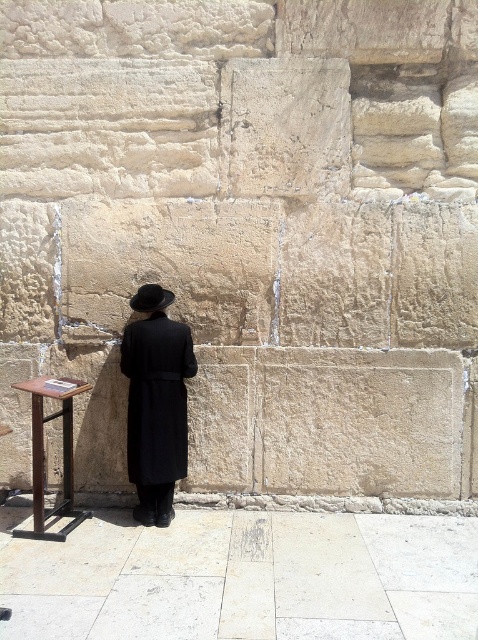
Can you confirm if brown wooden stool at lower left is positioned to the right of black felt fedora at center?

In fact, brown wooden stool at lower left is to the left of black felt fedora at center.

Image resolution: width=478 pixels, height=640 pixels. Identify the location of brown wooden stool at lower left. (43, 454).

You are a GUI agent. You are given a task and a screenshot of the screen. Output one action in this format:
    pyautogui.click(x=<x>, y=<y>)
    Task: Click on the brown wooden stool at lower left
    Image resolution: width=478 pixels, height=640 pixels.
    Given the screenshot: What is the action you would take?
    pyautogui.click(x=43, y=454)

Can you confirm if black matte coat at center is smaller than brown wooden stool at lower left?

Indeed, black matte coat at center has a smaller size compared to brown wooden stool at lower left.

Between point (173, 484) and point (35, 474), which one is positioned in front?

Point (35, 474)

Between point (186, 324) and point (80, 513), which one is positioned behind?

The point (186, 324) is more distant.

The image size is (478, 640). I want to click on black matte coat at center, so click(156, 397).

Is black matte coat at center thinner than black felt fedora at center?

No.

Which is more to the left, black matte coat at center or black felt fedora at center?

black felt fedora at center

Locate an element on the screen. Image resolution: width=478 pixels, height=640 pixels. black matte coat at center is located at coordinates (156, 397).

Locate an element on the screen. This screenshot has height=640, width=478. black matte coat at center is located at coordinates tap(156, 397).